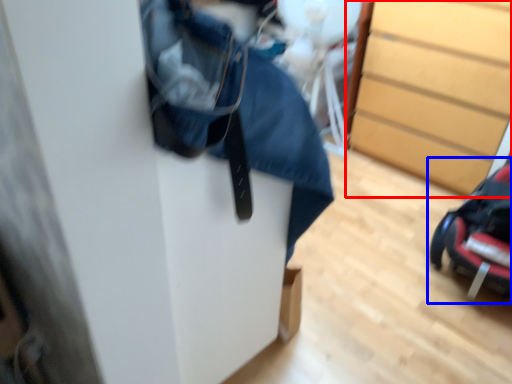
Question: Which point is further to the camera, chest of drawers (highlighted by a red box) or baby carriage (highlighted by a blue box)?

Choices:
 (A) chest of drawers
 (B) baby carriage

Answer: (A)